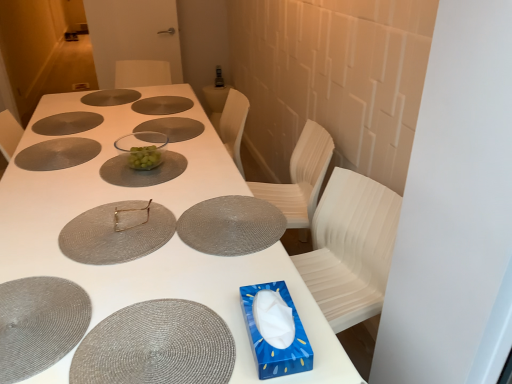
Locate an element on the screen. The image size is (512, 384). vacant space situated above transparent glass bowl at center, which is the fourth glass plate from front to back (from a real-world perspective) is located at coordinates (132, 165).